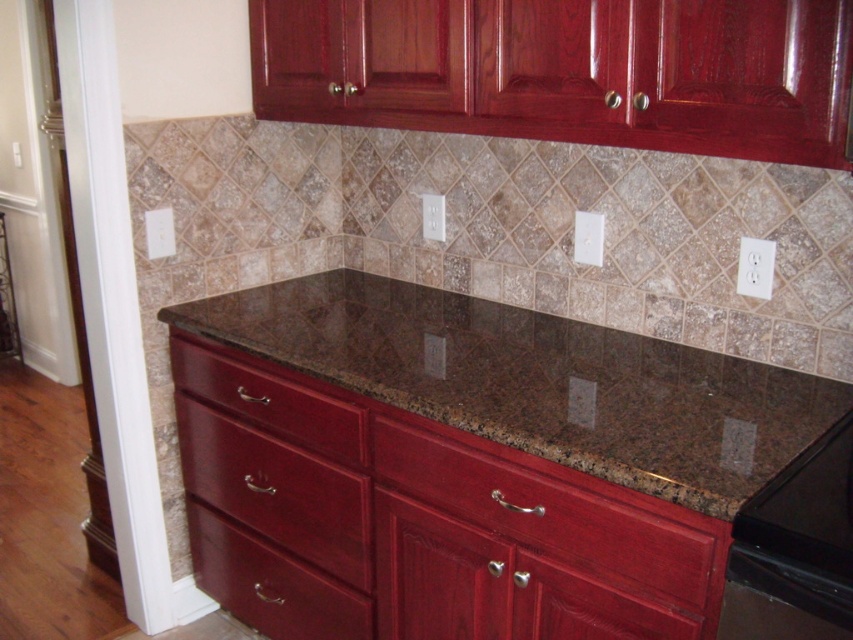
You are standing in the kitchen and want to place a small plant between the two points, point (827, 532) and point (364, 595). To ensure the plant is visible from where you are standing, which point should you place it closer to?

To ensure the plant is visible from where you are standing, place it closer to point (827, 532) because it is closer to the viewer than point (364, 595).

You are a chef preparing to place a large cutting board on the brown granite countertop at center. However, there is a matte wood drawer at center in the way. To clear space, which object should you move to access the area behind it?

The matte wood drawer at center is behind the brown granite countertop at center, so you should move the matte wood drawer at center to access the area behind it.

You are a kitchen designer and need to install a backsplash between the glossy wood cabinets at upper center and the brown granite countertop at center. What is the minimum distance you need to cover?

The glossy wood cabinets at upper center is 20.95 inches from the brown granite countertop at center, so the minimum distance to cover is 20.95 inches.